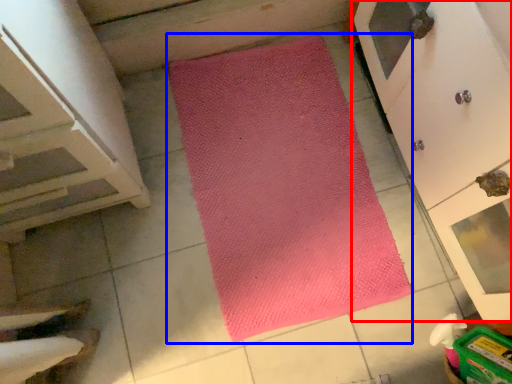
Question: Which object is further to the camera taking this photo, cupboard (highlighted by a red box) or mat (highlighted by a blue box)?

Choices:
 (A) cupboard
 (B) mat

Answer: (B)